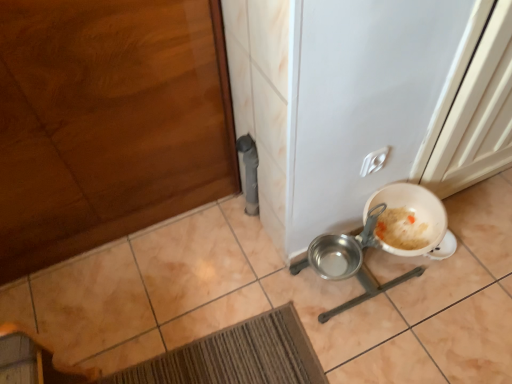
Find the location of a particular element. satin nickel door handle at upper right is located at coordinates (374, 161).

Describe the element at coordinates (374, 161) in the screenshot. I see `satin nickel door handle at upper right` at that location.

Where is `satin nickel door handle at upper right`? This screenshot has width=512, height=384. satin nickel door handle at upper right is located at coordinates (374, 161).